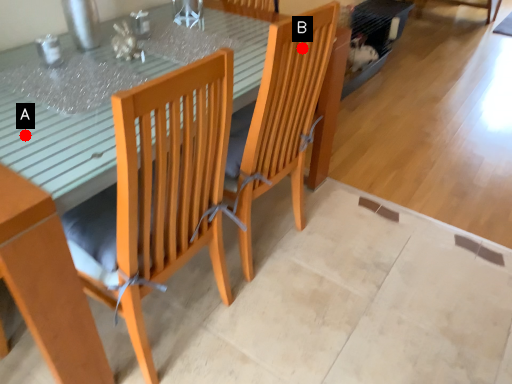
Question: Two points are circled on the image, labeled by A and B beside each circle. Which of the following is the closest to the observer?

Choices:
 (A) A is closer
 (B) B is closer

Answer: (A)